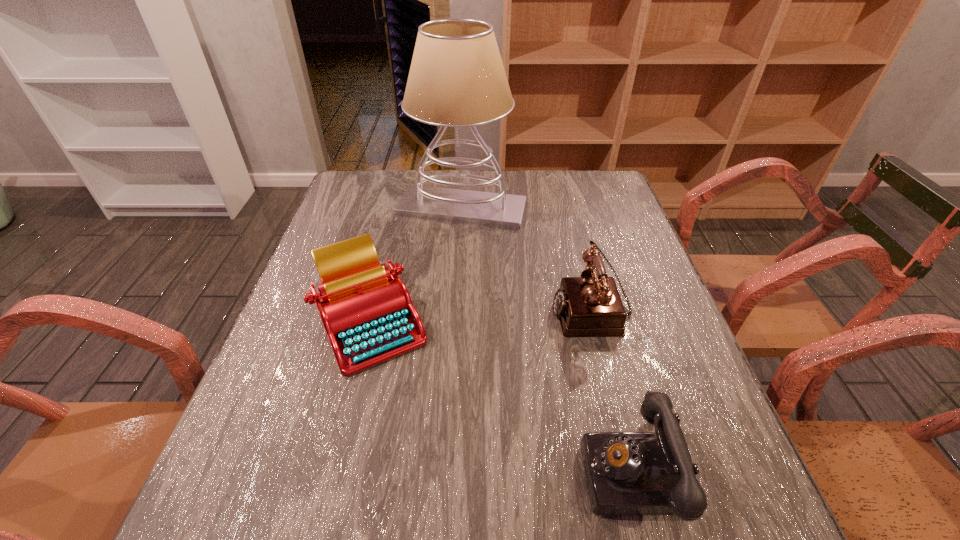
Image resolution: width=960 pixels, height=540 pixels. In order to click on object situated at the left edge in this screenshot , I will do `click(367, 312)`.

Where is `object present at the right edge`? This screenshot has width=960, height=540. object present at the right edge is located at coordinates (588, 306).

Find the location of a particular element. The width and height of the screenshot is (960, 540). free space at the far edge of the desktop is located at coordinates (557, 198).

Find the location of `free space at the near edge of the desktop`. free space at the near edge of the desktop is located at coordinates (371, 511).

In the image, there is a desktop. At what (x,y) coordinates should I click in order to perform the action: click on free space at the left edge. Please return your answer as a coordinate pair (x, y). Looking at the image, I should click on (307, 278).

Locate an element on the screen. vacant region at the right edge of the desktop is located at coordinates (638, 258).

You are a GUI agent. You are given a task and a screenshot of the screen. Output one action in this format:
    pyautogui.click(x=<x>, y=<y>)
    Task: Click on the vacant space at the near left corner of the desktop
    
    Given the screenshot: What is the action you would take?
    pyautogui.click(x=277, y=527)

Identify the location of vacant space at the near right corner. (741, 516).

The image size is (960, 540). Find the location of `vacant space that is in between the farther telephone and the farthest object`. vacant space that is in between the farther telephone and the farthest object is located at coordinates (526, 259).

I want to click on unoccupied position between the typewriter and the farthest object, so click(x=416, y=265).